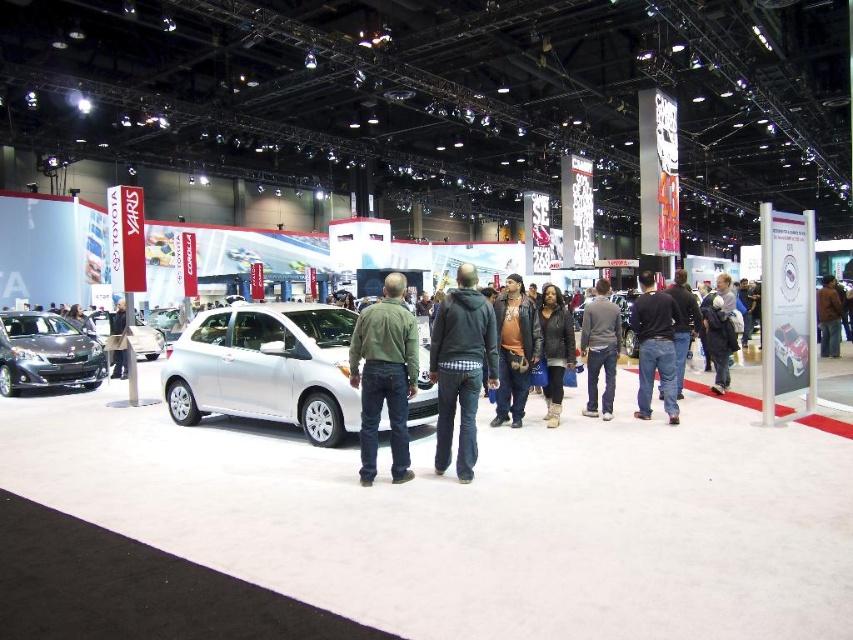
You are standing at point (804, 381) in the car exhibition hall. You want to move towards the white Toyota Yaris in the foreground. Is the point (686, 300) in your path?

Point (686, 300) is behind point (804, 381), so moving towards the white Toyota Yaris would not go through point (686, 300).